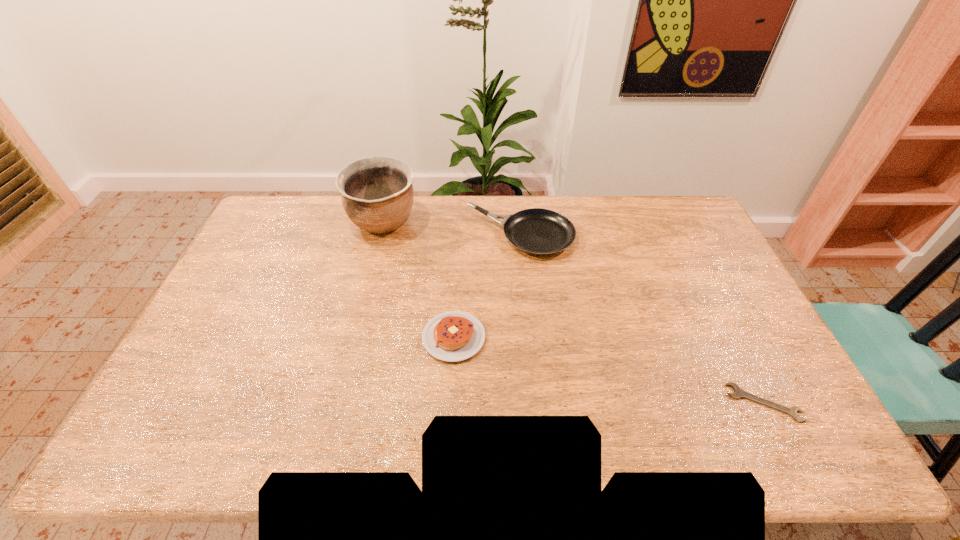
Locate which object ranks third in proximity to the second nearest object. Please provide its 2D coordinates. Your answer should be formatted as a tuple, i.e. [(x, y)], where the tuple contains the x and y coordinates of a point satisfying the conditions above.

[(738, 392)]

Locate which object ranks second in proximity to the pan. Please provide its 2D coordinates. Your answer should be formatted as a tuple, i.e. [(x, y)], where the tuple contains the x and y coordinates of a point satisfying the conditions above.

[(452, 336)]

Locate an element on the screen. This screenshot has width=960, height=540. vacant region that satisfies the following two spatial constraints: 1. on the back side of the second tallest object; 2. on the left side of the third farthest object is located at coordinates (459, 236).

This screenshot has width=960, height=540. I want to click on vacant space that satisfies the following two spatial constraints: 1. on the front side of the rightmost object; 2. on the left side of the pan, so click(537, 402).